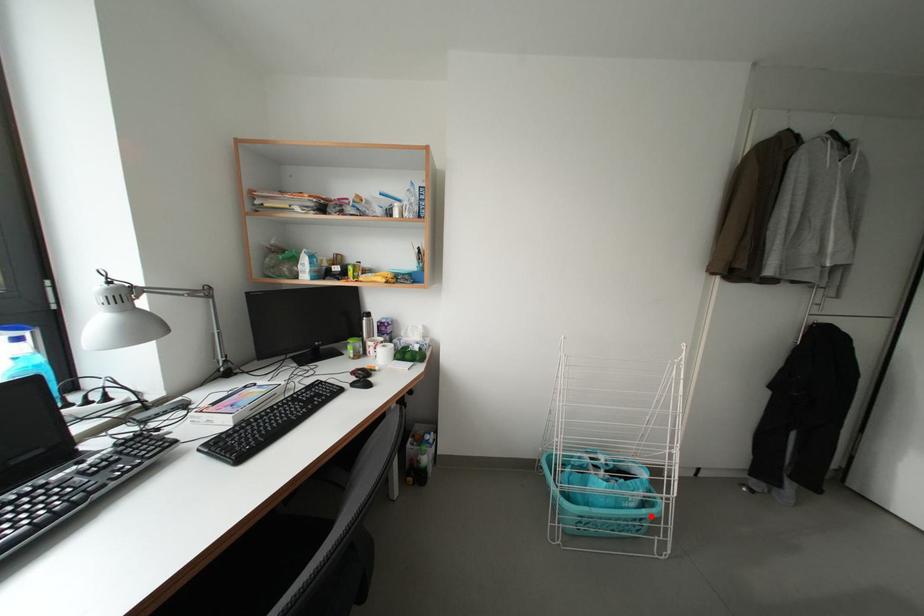
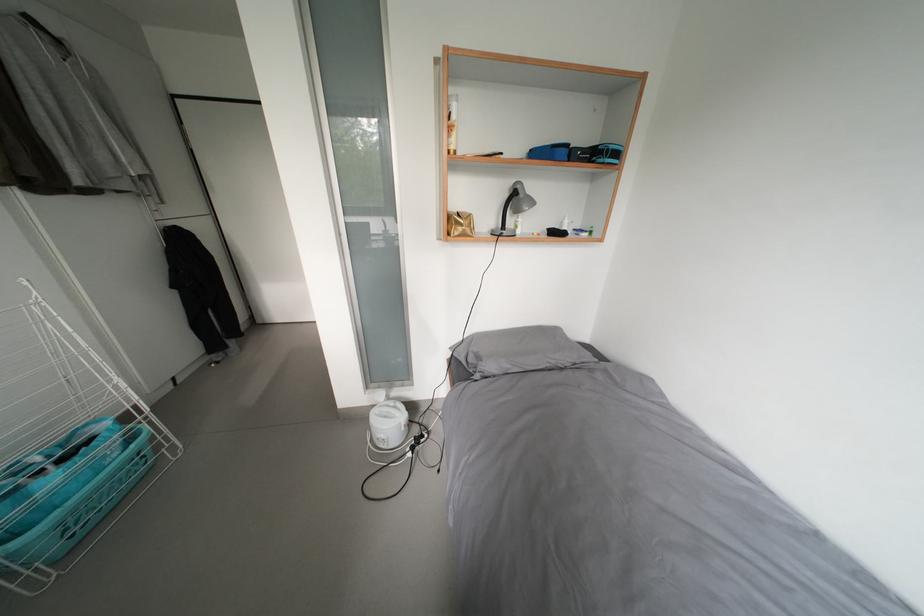
In the second image, find the point that corresponds to the highlighted location in the first image.

(140, 451)